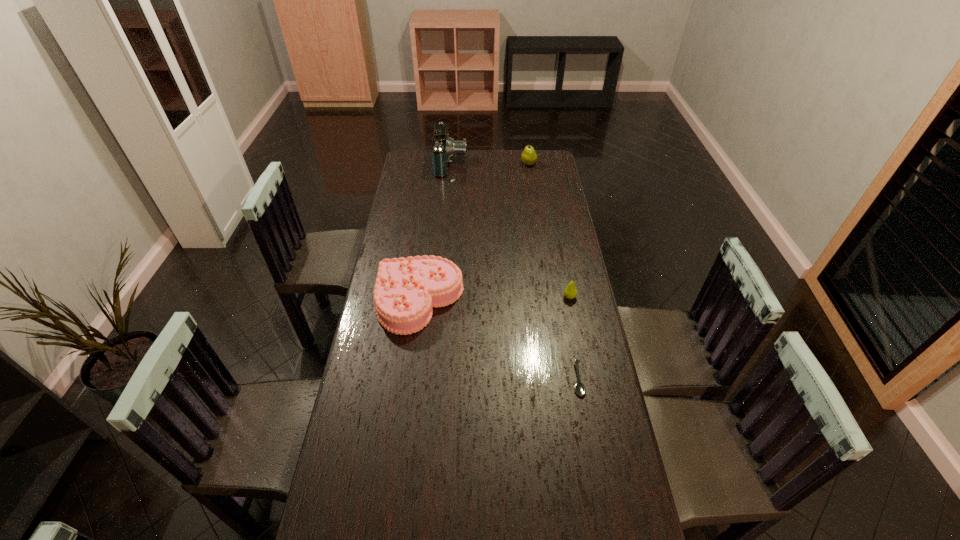
Where is `free region that satisfies the following two spatial constraints: 1. on the front-facing side of the tallest object; 2. on the left side of the left pear`? This screenshot has width=960, height=540. free region that satisfies the following two spatial constraints: 1. on the front-facing side of the tallest object; 2. on the left side of the left pear is located at coordinates (451, 164).

Identify the location of free point that satisfies the following two spatial constraints: 1. on the front-facing side of the camcorder; 2. on the back side of the shorter pear. (440, 297).